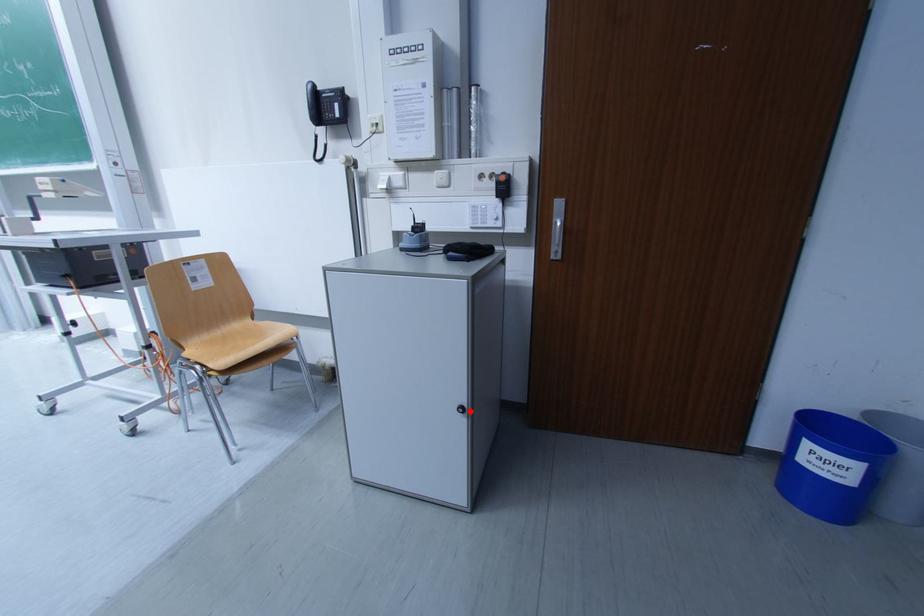
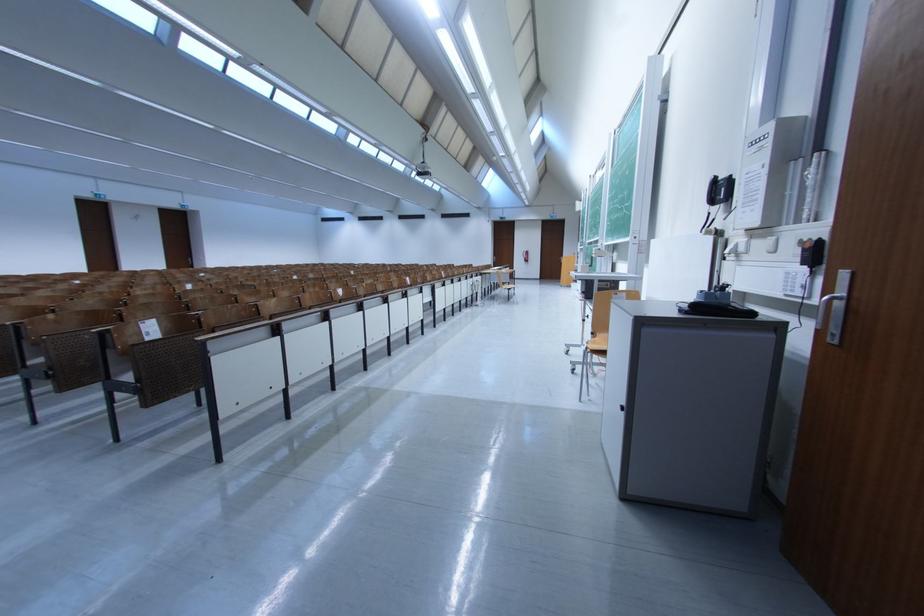
Find the pixel in the second image that matches the highlighted location in the first image.

(631, 410)